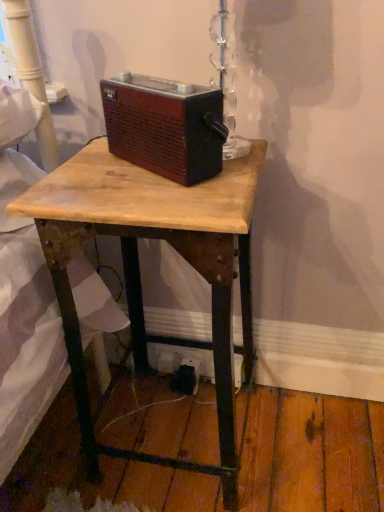
Identify the location of free point above wooden desk at center (from a real-world perspective). point(152,172).